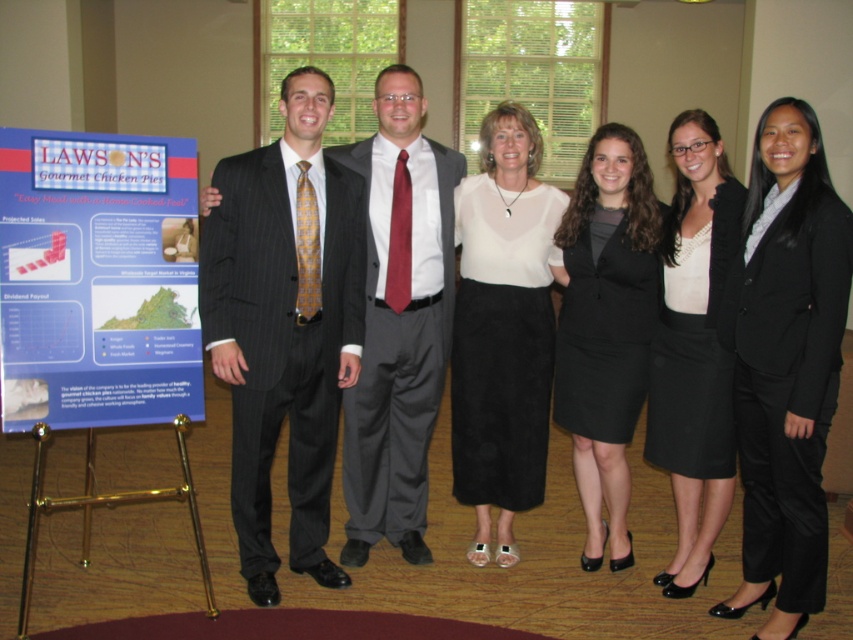
Which is above, black satin blazer at center or white matte blazer at center?

white matte blazer at center

Can you confirm if black satin blazer at center is positioned above white matte blazer at center?

Actually, black satin blazer at center is below white matte blazer at center.

Is point (795, 458) more distant than point (735, 205)?

No, it is in front of (735, 205).

Locate an element on the screen. This screenshot has height=640, width=853. black satin blazer at center is located at coordinates (786, 364).

Who is lower down, blue paperboard poster at left or pinstripe suit at center?

pinstripe suit at center

Who is higher up, blue paperboard poster at left or pinstripe suit at center?

blue paperboard poster at left

Who is more forward, (x=33, y=189) or (x=225, y=252)?

Point (x=33, y=189) is in front.

Identify the location of blue paperboard poster at left. Image resolution: width=853 pixels, height=640 pixels. (97, 280).

Is point (740, 282) closer to viewer compared to point (520, 115)?

Yes.

Which of these two, black satin blazer at center or white suede skirt at center, stands taller?

With more height is white suede skirt at center.

Where is `black satin blazer at center`? black satin blazer at center is located at coordinates (786, 364).